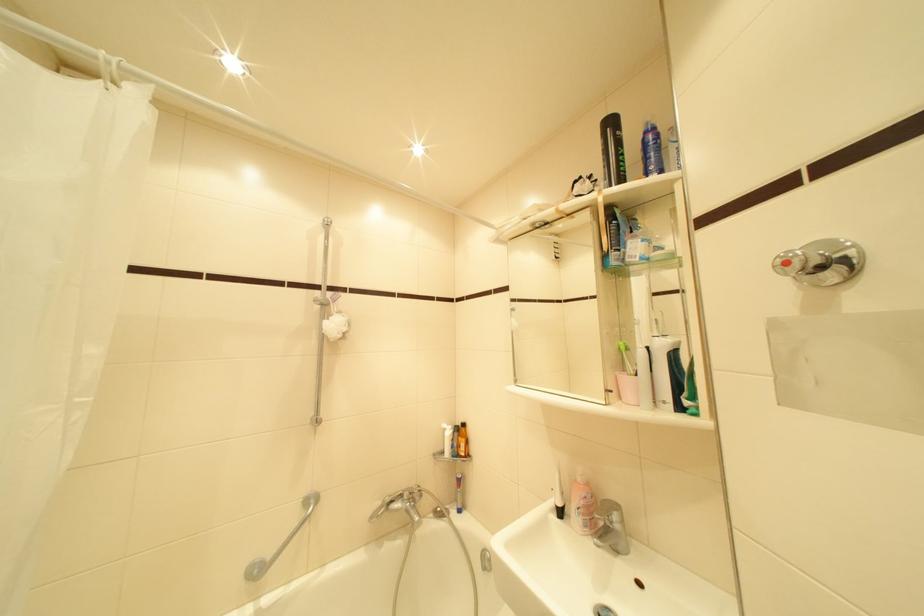
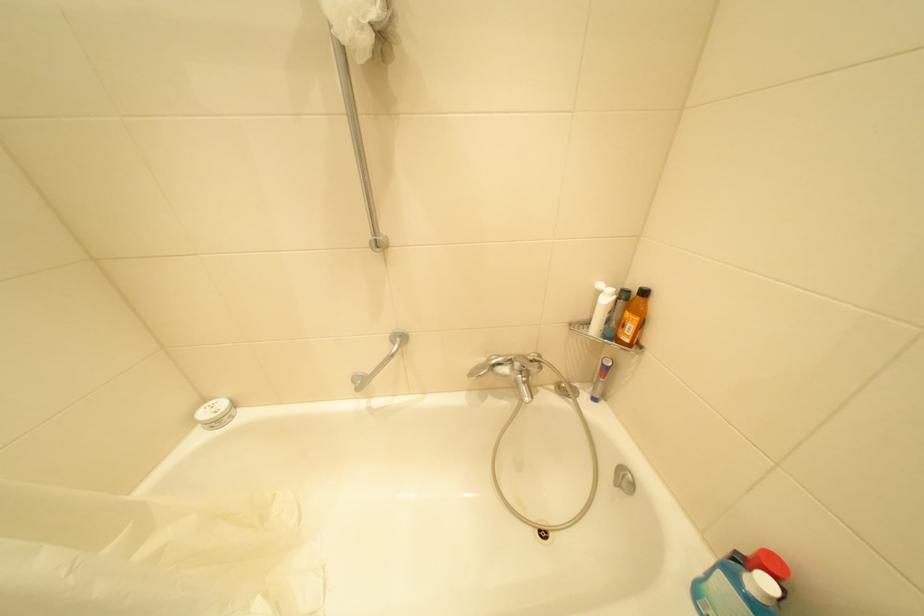
How did the camera likely rotate?

The rotation direction of the camera is left-down.